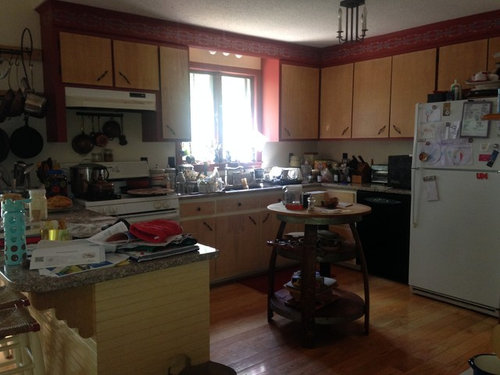
Where is `sink top`? The width and height of the screenshot is (500, 375). sink top is located at coordinates (256, 182).